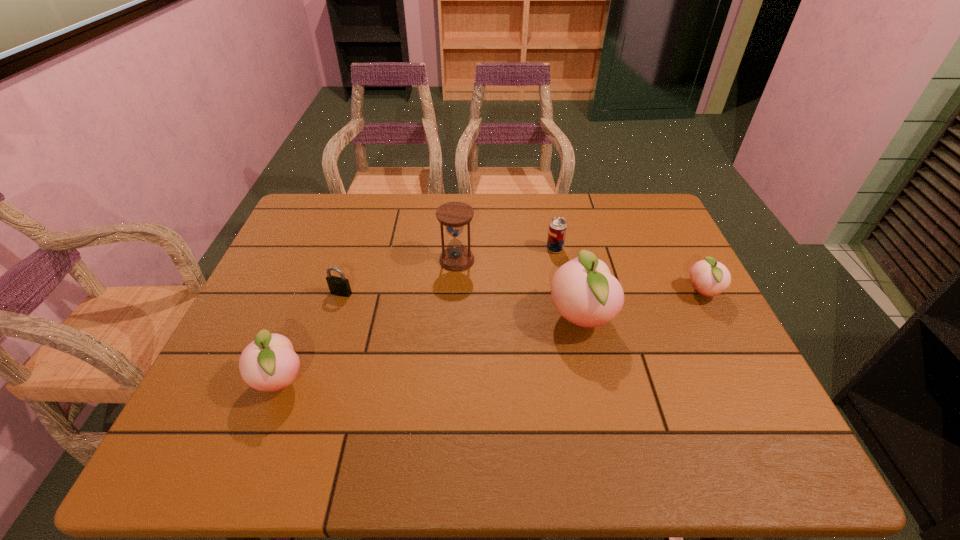
If we want them evenly spaced by inserting an extra peach among them, please locate a free spot for this new peach. Please provide its 2D coordinates. Your answer should be formatted as a tuple, i.e. [(x, y)], where the tuple contains the x and y coordinates of a point satisfying the conditions above.

[(440, 348)]